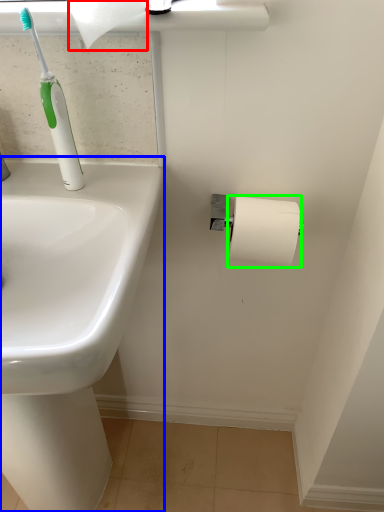
Question: Based on their relative distances, which object is farther from toilet paper (highlighted by a red box)? Choose from sink (highlighted by a blue box) and toilet paper (highlighted by a green box).

Choices:
 (A) sink
 (B) toilet paper

Answer: (A)